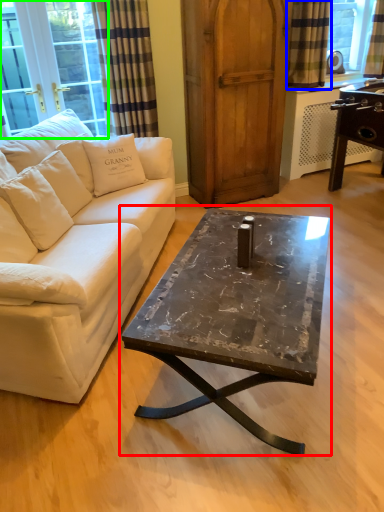
Question: Which object is the closest to the coffee table (highlighted by a red box)? Choose among these: curtain (highlighted by a blue box) or window screen (highlighted by a green box).

Choices:
 (A) curtain
 (B) window screen

Answer: (B)